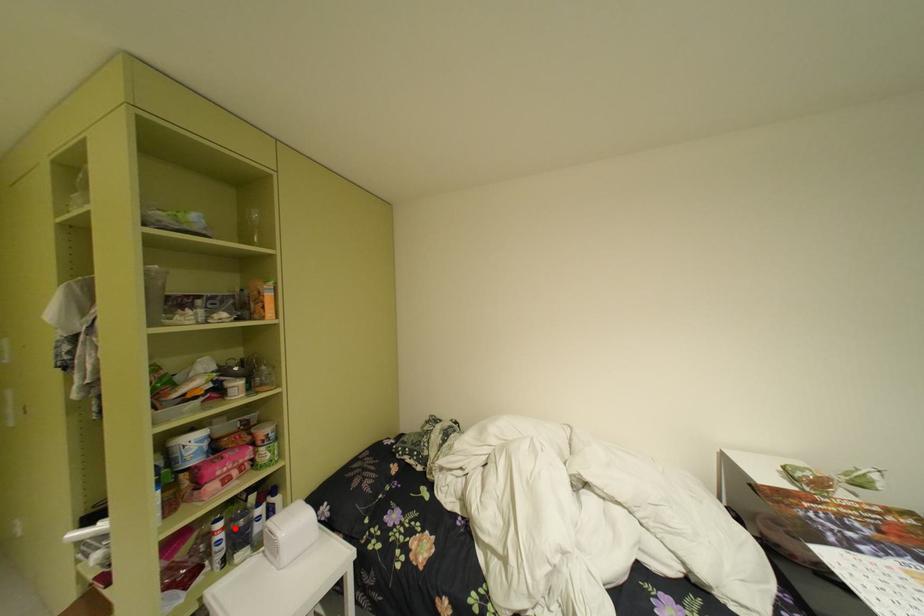
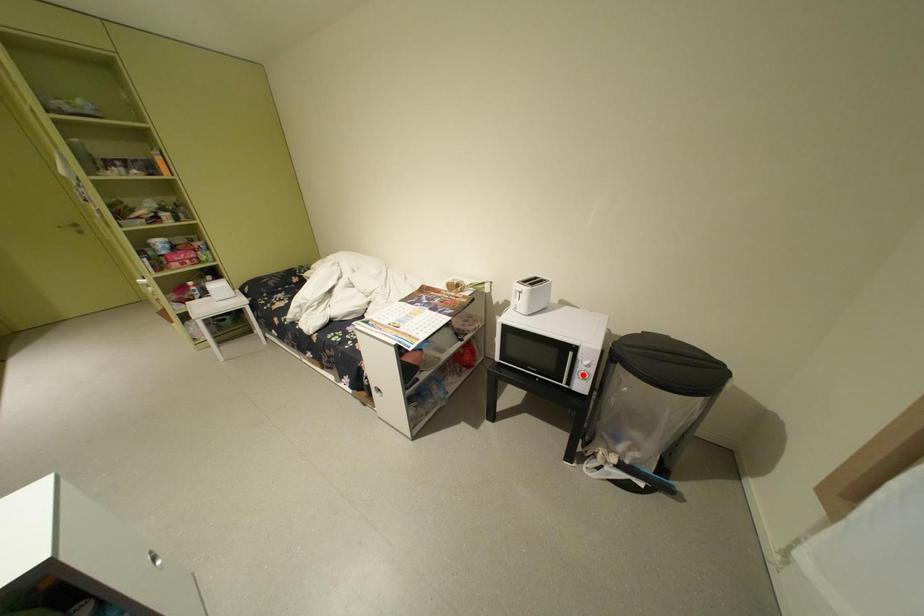
I am providing you with two images of the same scene from different viewpoints. A red point is marked on the first image and another point is marked on the second image. Does the point marked in image1 correspond to the same location as the one in image2?

No